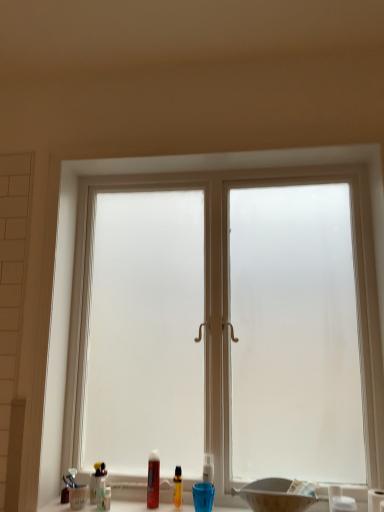
Question: Could you tell me if matte black basin at lower center is turned towards translucent plastic bottle at lower center, which appears as the 2th toiletry when viewed from the right?

Choices:
 (A) no
 (B) yes

Answer: (A)

Question: Is matte black basin at lower center to the left of translucent plastic bottle at lower center, the 3th toiletry from the left, from the viewer's perspective?

Choices:
 (A) yes
 (B) no

Answer: (B)

Question: From a real-world perspective, does matte black basin at lower center stand above translucent plastic bottle at lower center, placed as the 3th toiletry when sorted from front to back?

Choices:
 (A) yes
 (B) no

Answer: (B)

Question: From the image's perspective, is matte black basin at lower center on top of translucent plastic bottle at lower center, which appears as the 2th toiletry when viewed from the right?

Choices:
 (A) no
 (B) yes

Answer: (B)

Question: Does matte black basin at lower center touch translucent plastic bottle at lower center, positioned as the second toiletry in back-to-front order?

Choices:
 (A) no
 (B) yes

Answer: (A)

Question: Is the depth of matte black basin at lower center greater than that of translucent plastic bottle at lower center, positioned as the second toiletry in back-to-front order?

Choices:
 (A) no
 (B) yes

Answer: (A)

Question: Is the position of white plastic toothbrush at lower center, which is the 1th toiletry from front to back, more distant than that of translucent plastic toothbrush at lower center, which is the third toiletry in back-to-front order?

Choices:
 (A) no
 (B) yes

Answer: (A)

Question: From the image's perspective, is white plastic toothbrush at lower center, which is the fourth toiletry in back-to-front order, on top of translucent plastic toothbrush at lower center, positioned as the first toiletry in left-to-right order?

Choices:
 (A) no
 (B) yes

Answer: (B)

Question: Is white plastic toothbrush at lower center, which is the fourth toiletry in back-to-front order, looking in the opposite direction of translucent plastic toothbrush at lower center, which is the third toiletry in back-to-front order?

Choices:
 (A) yes
 (B) no

Answer: (B)

Question: Does white plastic toothbrush at lower center, which is the 1th toiletry from front to back, come in front of translucent plastic toothbrush at lower center, which is the third toiletry in back-to-front order?

Choices:
 (A) no
 (B) yes

Answer: (B)

Question: Does white plastic toothbrush at lower center, which is the fourth toiletry in back-to-front order, have a greater width compared to translucent plastic toothbrush at lower center, which is the third toiletry in back-to-front order?

Choices:
 (A) no
 (B) yes

Answer: (B)

Question: Does white plastic toothbrush at lower center, which is counted as the fourth toiletry, starting from the left, touch translucent plastic toothbrush at lower center, which is the third toiletry in back-to-front order?

Choices:
 (A) no
 (B) yes

Answer: (A)

Question: Does translucent plastic toothbrush at lower center, marked as the 4th toiletry in a right-to-left arrangement, have a greater height compared to translucent plastic bottle at lower center, the 3th toiletry from the left?

Choices:
 (A) no
 (B) yes

Answer: (A)